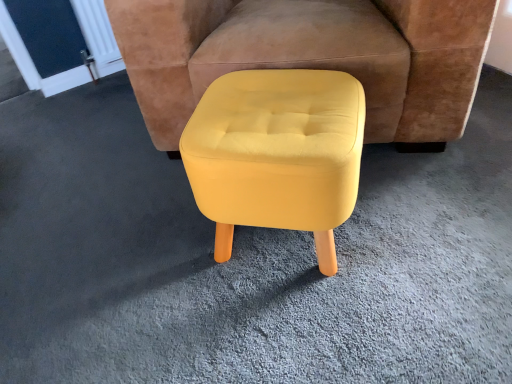
Locate an element on the screen. The height and width of the screenshot is (384, 512). free location in front of yellow fabric ottoman at center is located at coordinates point(296,273).